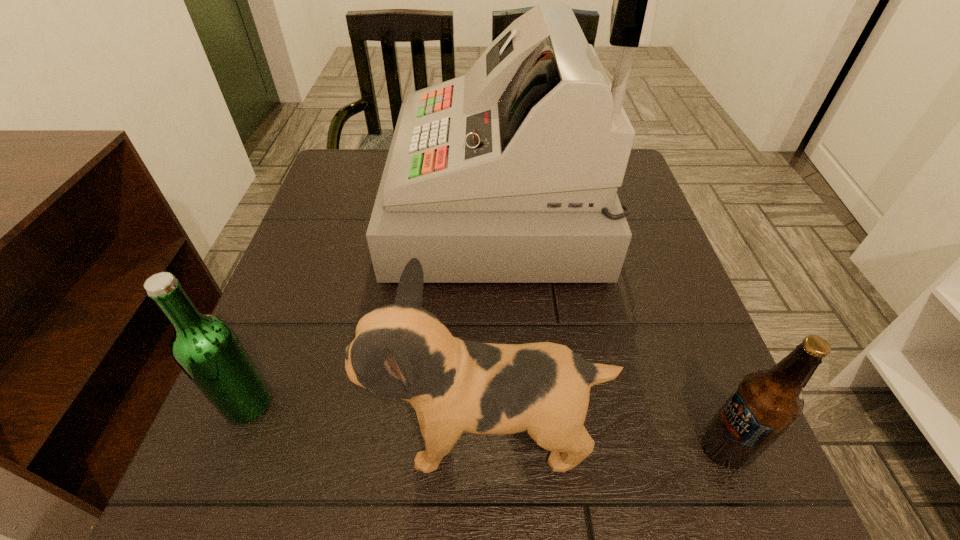
Where is `vacant region located 0.220m at the face of the puppy`? This screenshot has width=960, height=540. vacant region located 0.220m at the face of the puppy is located at coordinates (228, 434).

Locate an element on the screen. The height and width of the screenshot is (540, 960). free spot located 0.240m on the back of the left beer bottle is located at coordinates (298, 278).

Where is `free space located on the label of the rightmost object`? The image size is (960, 540). free space located on the label of the rightmost object is located at coordinates (655, 448).

Image resolution: width=960 pixels, height=540 pixels. I want to click on free space located on the label of the rightmost object, so click(x=532, y=448).

Where is `vacant space located 0.210m on the label of the rightmost object`? This screenshot has width=960, height=540. vacant space located 0.210m on the label of the rightmost object is located at coordinates (560, 448).

What are the coordinates of `object positioned at the far edge` in the screenshot? It's located at (508, 174).

Where is `puppy at the near edge`? Image resolution: width=960 pixels, height=540 pixels. puppy at the near edge is located at coordinates (401, 350).

Find the location of `beer bottle that is at the near edge`. beer bottle that is at the near edge is located at coordinates (766, 403).

This screenshot has width=960, height=540. Find the location of `object situated at the left edge`. object situated at the left edge is located at coordinates (206, 348).

In order to click on cash register that is at the right edge in this screenshot , I will do `click(508, 174)`.